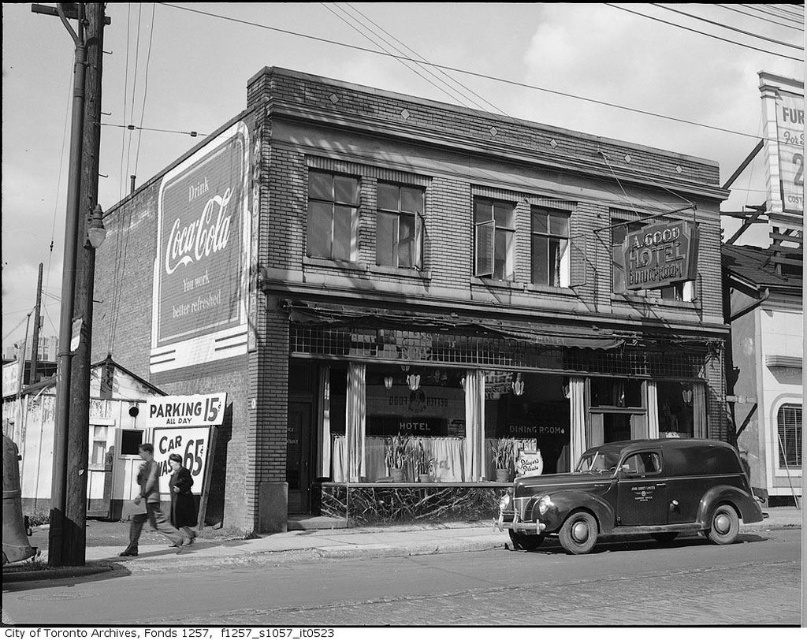
You are a delivery person who needs to load a 2.5 meters tall package into your truck. You are standing in front of the matte glass storefront at center and the shiny black sedan at center. Which object can the package fit through without bending?

The matte glass storefront at center is much taller as shiny black sedan at center, so the package can fit through the matte glass storefront at center without bending.

You are standing on the street and want to enter the building with the Coca Cola advertisement. You see a matte glass storefront at center and a shiny black sedan at center. Which object is closer to you?

The matte glass storefront at center is closer to you than the shiny black sedan at center because it is further to the viewer.